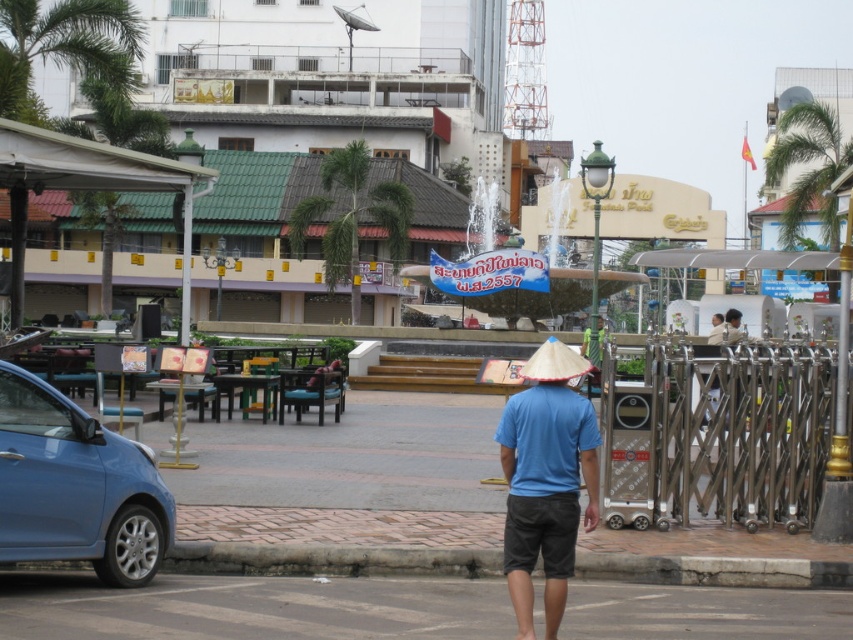
You are a delivery person trying to park your motorcycle between the gray asphalt pavement at center and the blue metallic car at lower left. Which area has more space available for parking?

The blue metallic car at lower left has more space available for parking because it occupies more space than the gray asphalt pavement at center.

You are a delivery person needing to park your motorcycle on the gray asphalt pavement at center. There is a green leafy palm tree at upper left nearby. Can you park your motorcycle under the palm tree to avoid the rain?

The gray asphalt pavement at center is below green leafy palm tree at upper left, so yes, you can park your motorcycle under the palm tree to stay dry from the rain.